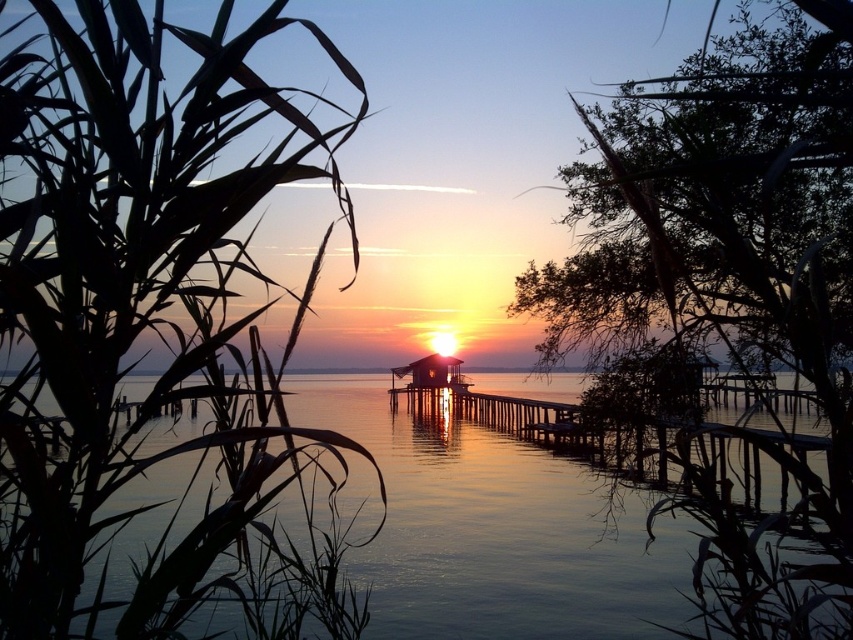
Question: Can you confirm if silky green leaves at left is positioned to the right of transparent water at center?

Choices:
 (A) yes
 (B) no

Answer: (B)

Question: Which point appears farthest from the camera in this image?

Choices:
 (A) (19, 83)
 (B) (386, 404)
 (C) (819, 109)

Answer: (B)

Question: Estimate the real-world distances between objects in this image. Which object is closer to the green leafy tree at upper right?

Choices:
 (A) silky green leaves at left
 (B) transparent water at center

Answer: (B)

Question: Observing the image, what is the correct spatial positioning of silky green leaves at left in reference to transparent water at center?

Choices:
 (A) above
 (B) below

Answer: (A)

Question: Which point is farther from the camera taking this photo?

Choices:
 (A) (599, 177)
 (B) (614, 500)

Answer: (A)

Question: Is silky green leaves at left positioned at the back of green leafy tree at upper right?

Choices:
 (A) no
 (B) yes

Answer: (A)